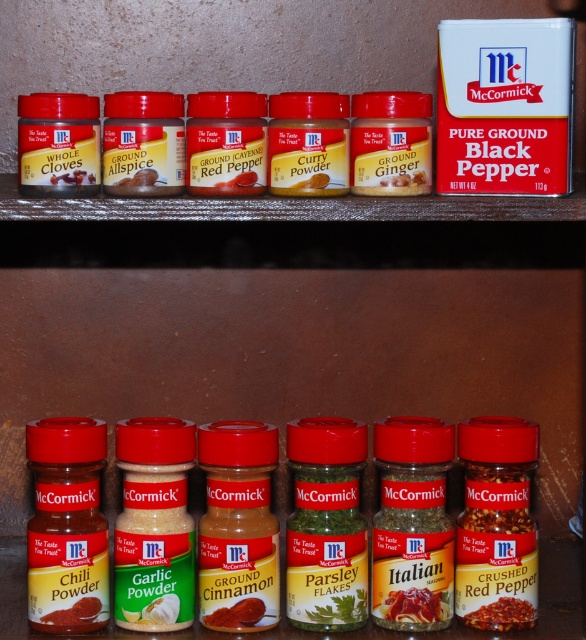
You are organizing spices in a kitchen. You need to place a new spice jar exactly at the center of the McCormick spice collection displayed. Which spice jar should you place at point [236,612]?

The ground cinnamon at center is located at point [236,612], so you should place the new spice jar there.

You are organizing spices in a kitchen. You have a red matte crushed red pepper at center and a ground cinnamon at center. According to the image, which spice is positioned to the right of the other?

The red matte crushed red pepper at center is positioned to the right of ground cinnamon at center.